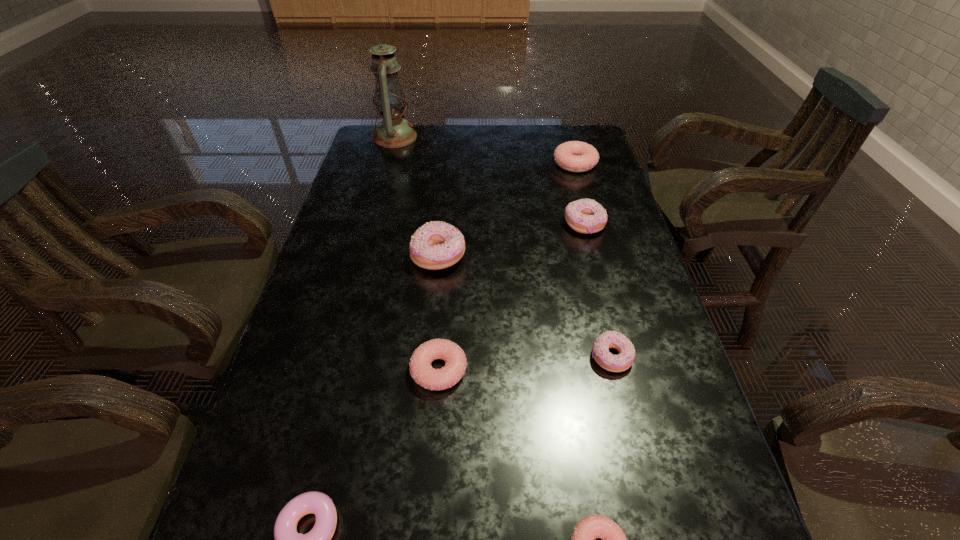
Find the location of `object located in the far right corner section of the desktop`. object located in the far right corner section of the desktop is located at coordinates (574, 156).

In the image, there is a desktop. Where is `vacant space at the far edge`? The width and height of the screenshot is (960, 540). vacant space at the far edge is located at coordinates (499, 129).

Locate an element on the screen. This screenshot has height=540, width=960. vacant space at the left edge of the desktop is located at coordinates (243, 464).

This screenshot has height=540, width=960. I want to click on vacant area at the right edge of the desktop, so click(x=574, y=181).

The height and width of the screenshot is (540, 960). Identify the location of vacant area at the far right corner of the desktop. (569, 139).

At what (x,y) coordinates should I click in order to perform the action: click on empty space that is in between the second nearest pink doughnut and the rightmost pink doughnut. Please return your answer as a coordinate pair (x, y). The image size is (960, 540). Looking at the image, I should click on (507, 267).

Where is `free area in between the second nearest purple doughnut and the farthest pink doughnut`? This screenshot has width=960, height=540. free area in between the second nearest purple doughnut and the farthest pink doughnut is located at coordinates (593, 260).

At what (x,y) coordinates should I click in order to perform the action: click on blank region between the leftmost pink doughnut and the second biggest purple doughnut. Please return your answer as a coordinate pair (x, y). Looking at the image, I should click on (512, 297).

Find the location of a particular element. This screenshot has height=540, width=960. blank region between the third smallest purple doughnut and the second nearest purple doughnut is located at coordinates (597, 291).

Locate an element on the screen. free spot between the rightmost pink doughnut and the second farthest pink doughnut is located at coordinates (507, 267).